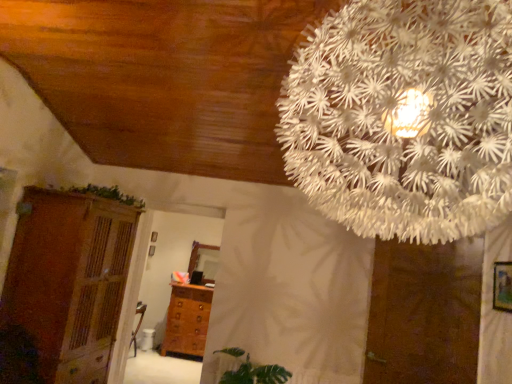
Find the location of `brown wooden dresser at left`. brown wooden dresser at left is located at coordinates (70, 279).

Describe the element at coordinates (187, 320) in the screenshot. I see `wooden chest of drawers at center` at that location.

In order to face green leafy plant at lower center, should I rotate leftwards or rightwards?

Rotate your view left by about 1.015°.

Find the location of a particular element. This screenshot has height=384, width=512. wooden picture frame at right is located at coordinates (502, 286).

Where is `brown wooden dresser at left`? The image size is (512, 384). brown wooden dresser at left is located at coordinates (70, 279).

From a real-world perspective, between brown wooden dresser at left and white paper flower at upper center, who is vertically higher?

white paper flower at upper center, from a real-world perspective.

Does point (5, 300) lie in front of point (422, 229)?

No.

Are brown wooden dresser at left and white paper flower at upper center beside each other?

brown wooden dresser at left and white paper flower at upper center are not in contact.

Is brown wooden dresser at left inside the boundaries of white paper flower at upper center, or outside?

brown wooden dresser at left is spatially situated outside white paper flower at upper center.

How different are the orientations of wooden picture frame at right and green leafy plant at upper left in degrees?

wooden picture frame at right and green leafy plant at upper left are facing 179 degrees away from each other.

Does wooden picture frame at right have a larger size compared to green leafy plant at upper left?

No.

Where is `plant on the left side of wooden picture frame at right`? plant on the left side of wooden picture frame at right is located at coordinates (106, 194).

Which is behind, point (508, 294) or point (143, 201)?

The point (143, 201) is behind.

In the image, is green leafy plant at upper left positioned in front of or behind brown wooden dresser at left?

green leafy plant at upper left is positioned farther from the viewer than brown wooden dresser at left.

From the image's perspective, is green leafy plant at upper left over brown wooden dresser at left?

Yes, from the image's perspective, green leafy plant at upper left is above brown wooden dresser at left.

Can you tell me how much green leafy plant at upper left and brown wooden dresser at left differ in facing direction?

The angle between the facing direction of green leafy plant at upper left and the facing direction of brown wooden dresser at left is 1.54 degrees.

Between green leafy plant at upper left and brown wooden dresser at left, which one has larger size?

brown wooden dresser at left is bigger.

Is green leafy plant at lower center bigger than white paper flower at upper center?

No.

Does point (257, 373) come closer to viewer compared to point (337, 69)?

No, it is not.

From the picture: Considering the positions of objects green leafy plant at lower center and white paper flower at upper center in the image provided, who is more to the right, green leafy plant at lower center or white paper flower at upper center?

white paper flower at upper center.

Based on the photo, is wooden chest of drawers at center directly adjacent to brown matte door at lower right?

They are not placed beside each other.

In the scene shown: Is wooden chest of drawers at center taller or shorter than brown matte door at lower right?

In the image, wooden chest of drawers at center appears to be shorter than brown matte door at lower right.

From the picture: Which of these two, wooden chest of drawers at center or brown matte door at lower right, is wider?

With larger width is wooden chest of drawers at center.

Is wooden chest of drawers at center positioned beyond the bounds of brown matte door at lower right?

Absolutely, wooden chest of drawers at center is external to brown matte door at lower right.

Can you confirm if green leafy plant at lower center is wider than brown matte door at lower right?

Correct, the width of green leafy plant at lower center exceeds that of brown matte door at lower right.

Is brown matte door at lower right surrounded by green leafy plant at lower center?

That's incorrect, brown matte door at lower right is not inside green leafy plant at lower center.

Consider the image. From a real-world perspective, is green leafy plant at lower center above or below brown matte door at lower right?

From a real-world perspective, green leafy plant at lower center is physically below brown matte door at lower right.

Does point (242, 367) come behind point (366, 369)?

Yes, point (242, 367) is behind point (366, 369).

Are white paper flower at upper center and wooden chest of drawers at center beside each other?

No, white paper flower at upper center is not beside wooden chest of drawers at center.

Consider the image. From the image's perspective, is white paper flower at upper center under wooden chest of drawers at center?

No.

Is white paper flower at upper center facing away from wooden chest of drawers at center?

No.

Considering the sizes of objects white paper flower at upper center and wooden chest of drawers at center in the image provided, who is wider, white paper flower at upper center or wooden chest of drawers at center?

white paper flower at upper center is wider.

Locate an element on the screen. This screenshot has width=512, height=384. dresser lying behind the white paper flower at upper center is located at coordinates (70, 279).

What are the coordinates of `picture frame located in front of the green leafy plant at upper left` in the screenshot? It's located at (502, 286).

From the image, which object appears to be nearer to wooden picture frame at right, green leafy plant at lower center or wooden chest of drawers at center?

green leafy plant at lower center lies closer to wooden picture frame at right than the other object.

Estimate the real-world distances between objects in this image. Which object is closer to brown wooden dresser at left, green leafy plant at lower center or white paper flower at upper center?

green leafy plant at lower center is closer to brown wooden dresser at left.

Based on the photo, when comparing their distances from brown matte door at lower right, does white paper flower at upper center or green leafy plant at upper left seem further?

green leafy plant at upper left.

Estimate the real-world distances between objects in this image. Which object is further from green leafy plant at upper left, green leafy plant at lower center or brown wooden dresser at left?

The object further to green leafy plant at upper left is green leafy plant at lower center.

When comparing their distances from brown wooden dresser at left, does wooden chest of drawers at center or white paper flower at upper center seem closer?

wooden chest of drawers at center lies closer to brown wooden dresser at left than the other object.

Which object lies nearer to the anchor point brown wooden dresser at left, wooden chest of drawers at center or green leafy plant at lower center?

Based on the image, green leafy plant at lower center appears to be nearer to brown wooden dresser at left.

Which object lies nearer to the anchor point wooden picture frame at right, green leafy plant at upper left or brown matte door at lower right?

brown matte door at lower right is positioned closer to the anchor wooden picture frame at right.

Estimate the real-world distances between objects in this image. Which object is closer to wooden picture frame at right, white paper flower at upper center or brown wooden dresser at left?

white paper flower at upper center.

Find the location of a particular element. plant positioned between white paper flower at upper center and wooden chest of drawers at center from near to far is located at coordinates (106, 194).

The image size is (512, 384). What are the coordinates of `plant between brown wooden dresser at left and brown matte door at lower right` in the screenshot? It's located at (106, 194).

In order to click on houseplant between white paper flower at upper center and brown wooden dresser at left in the front-back direction in this screenshot , I will do `click(251, 370)`.

Find the location of a particular element. The width and height of the screenshot is (512, 384). door situated between green leafy plant at lower center and wooden picture frame at right from left to right is located at coordinates (424, 313).